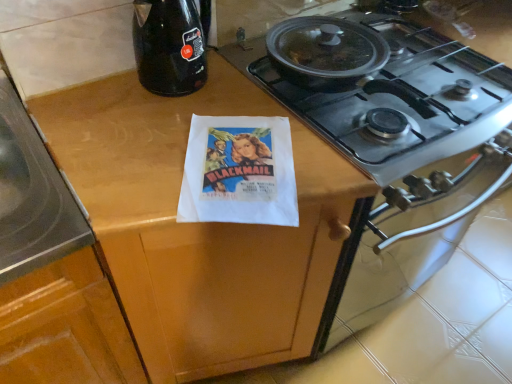
Find the location of `vacant space that is to the left of black glass bottle at upper left`. vacant space that is to the left of black glass bottle at upper left is located at coordinates (100, 97).